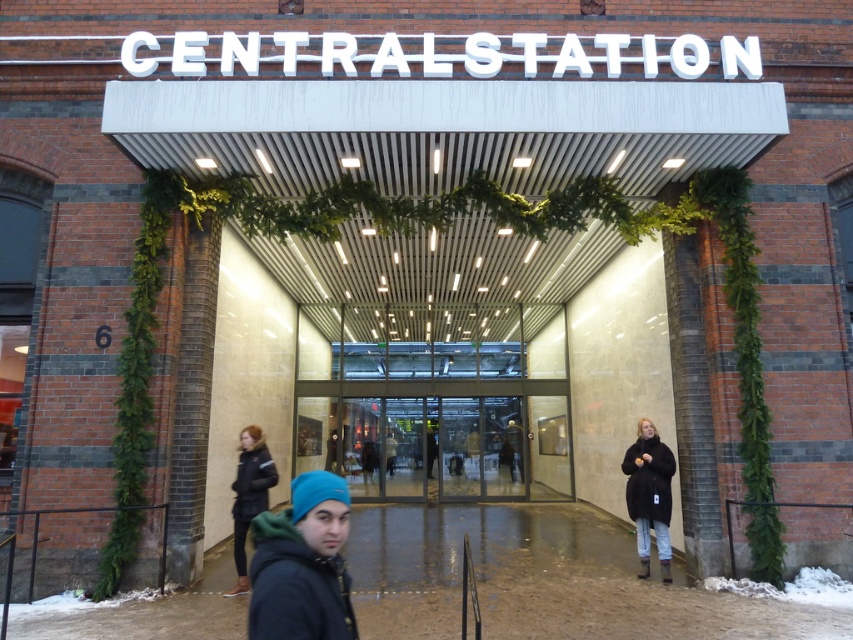
Question: Which point appears closest to the camera in this image?

Choices:
 (A) 334,593
 (B) 231,515
 (C) 799,579

Answer: (A)

Question: Is blue knit cap at lower center positioned behind black fuzzy coat at lower right?

Choices:
 (A) no
 (B) yes

Answer: (A)

Question: Is transparent glass doors at center wider than black jacket at lower left?

Choices:
 (A) no
 (B) yes

Answer: (B)

Question: Estimate the real-world distances between objects in this image. Which object is closer to the white fluffy snow at lower right?

Choices:
 (A) transparent glass doors at center
 (B) blue knit cap at lower center
 (C) black jacket at lower left

Answer: (C)

Question: Which object is the farthest from the blue knit cap at lower center?

Choices:
 (A) black jacket at lower left
 (B) black fuzzy coat at lower right

Answer: (B)

Question: Is blue knit cap at lower center further to camera compared to white fluffy snow at lower right?

Choices:
 (A) no
 (B) yes

Answer: (A)